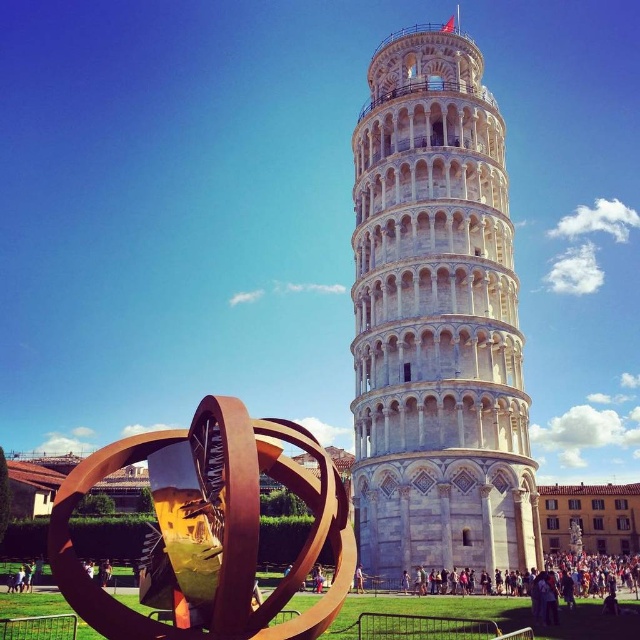
Question: Does white stone tower at center come in front of rusty metal sphere at lower left?

Choices:
 (A) no
 (B) yes

Answer: (A)

Question: Which object is closer to the camera taking this photo?

Choices:
 (A) rusty metal sphere at lower left
 (B) white stone tower at center

Answer: (A)

Question: Does white stone tower at center have a greater width compared to rusty metal sphere at lower left?

Choices:
 (A) no
 (B) yes

Answer: (B)

Question: From the image, what is the correct spatial relationship of white stone tower at center in relation to rusty metal sphere at lower left?

Choices:
 (A) left
 (B) right

Answer: (B)